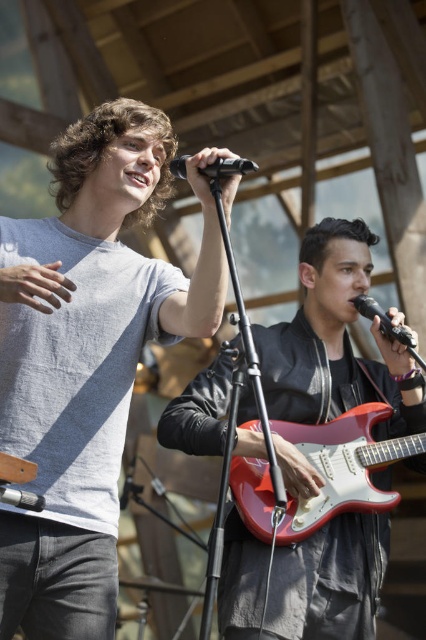
Is glossy red electric guitar at lower right shorter than black matte microphone at center?

In fact, glossy red electric guitar at lower right may be taller than black matte microphone at center.

The width and height of the screenshot is (426, 640). I want to click on glossy red electric guitar at lower right, so click(342, 467).

Identify the location of glossy red electric guitar at lower right. This screenshot has height=640, width=426. (342, 467).

Does gray cotton t-shirt at center have a lesser height compared to black matte microphone at right?

In fact, gray cotton t-shirt at center may be taller than black matte microphone at right.

Identify the location of gray cotton t-shirt at center. The image size is (426, 640). (88, 356).

Measure the distance between point (40, 580) and camera.

Point (40, 580) and camera are 7.64 feet apart.

Image resolution: width=426 pixels, height=640 pixels. What are the coordinates of `gray cotton t-shirt at center` in the screenshot? It's located at (88, 356).

Is gray cotton t-shirt at center further to camera compared to black matte microphone at center?

Yes, gray cotton t-shirt at center is further from the viewer.

Is point (66, 141) behind point (233, 172)?

Yes.

In order to click on gray cotton t-shirt at center in this screenshot , I will do `click(88, 356)`.